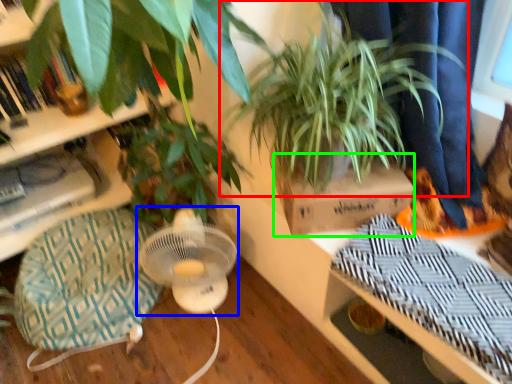
Question: Which object is the closest to the houseplant (highlighted by a red box)? Choose among these: mechanical fan (highlighted by a blue box) or cardboard box (highlighted by a green box).

Choices:
 (A) mechanical fan
 (B) cardboard box

Answer: (B)